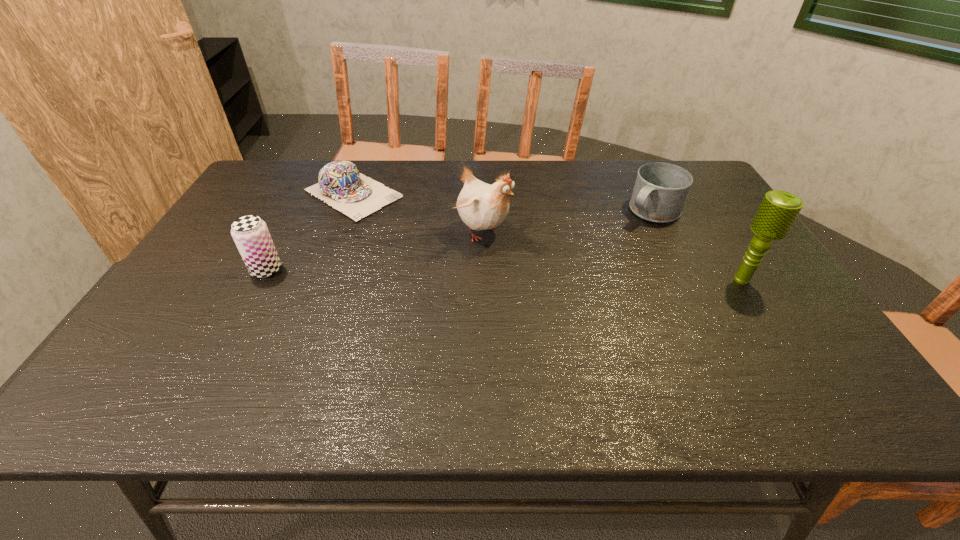
Where is `vacant area that satisfies the following two spatial constraints: 1. on the front side of the rightmost object; 2. on the right side of the second object from right to left`? vacant area that satisfies the following two spatial constraints: 1. on the front side of the rightmost object; 2. on the right side of the second object from right to left is located at coordinates (685, 280).

The height and width of the screenshot is (540, 960). In order to click on free region that satisfies the following two spatial constraints: 1. on the front side of the rightmost object; 2. on the right side of the third shortest object in this screenshot , I will do `click(261, 280)`.

Identify the location of free location that satisfies the following two spatial constraints: 1. on the front side of the third object from right to left; 2. on the left side of the microphone. (479, 280).

This screenshot has width=960, height=540. I want to click on free space in the image that satisfies the following two spatial constraints: 1. on the front side of the third object from right to left; 2. on the left side of the microphone, so click(x=479, y=280).

Locate an element on the screen. free point that satisfies the following two spatial constraints: 1. on the front side of the second object from right to left; 2. on the left side of the microphone is located at coordinates (685, 280).